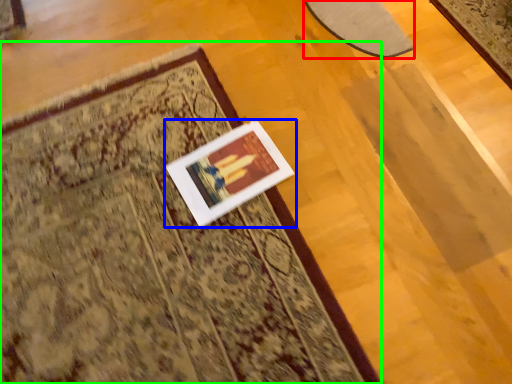
Question: Considering the real-world distances, which object is closest to mat (highlighted by a red box)? picture frame (highlighted by a blue box) or mat (highlighted by a green box).

Choices:
 (A) picture frame
 (B) mat

Answer: (A)